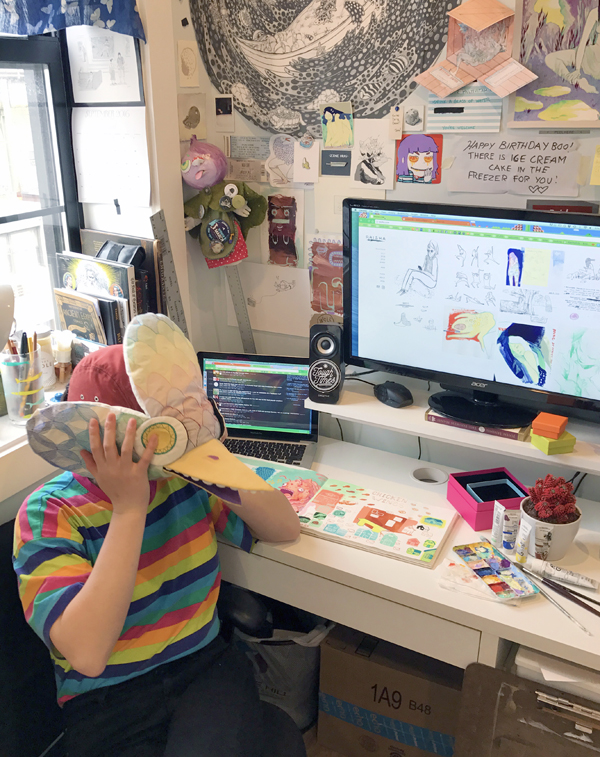
Locate an element on the screen. This screenshot has height=757, width=600. laptop is located at coordinates (268, 397).